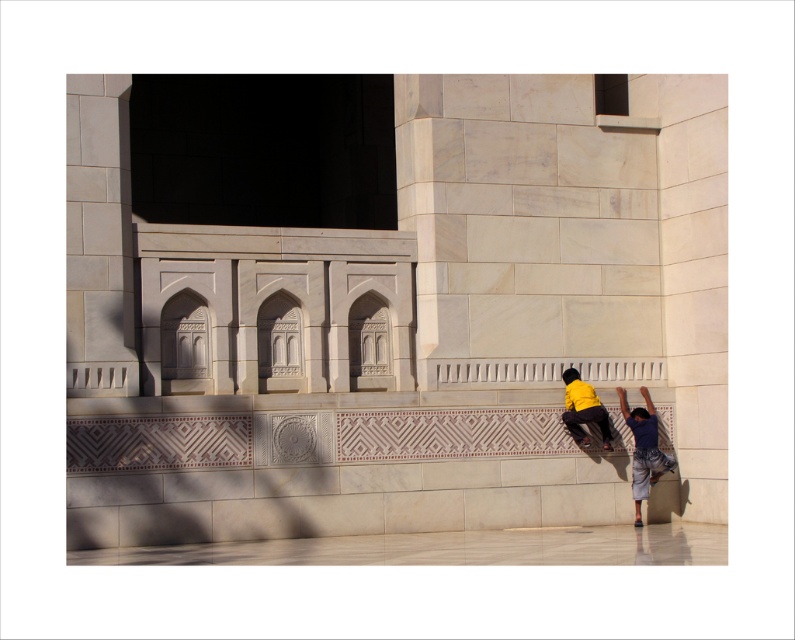
You are a drone operator trying to capture a photo of the two points on the wall. The points are labeled as point 1 and point 2. Given that point 1 is at coordinates point (654, 468) and point 2 is at point (576, 424), which point should you focus on first if you want to ensure both are in focus without adjusting the camera distance?

Point 1 is further to the camera than point 2, so focusing on point 1 first will ensure both points are in focus without needing to adjust the camera distance.

You are standing at the base of the stone wall and want to reach the point marked as point (636, 497). If you have a ladder that is 20 meters long, will it be sufficient to reach that point?

The point (636, 497) is 18.19 meters from the camera, so a 20 meter ladder would be sufficient to reach it.

You are an observer standing in front of the stone wall. You see the blue denim pants at lower right and the yellow matte skateboard at lower center. Which object is wider?

The blue denim pants at lower right is wider than the yellow matte skateboard at lower center.